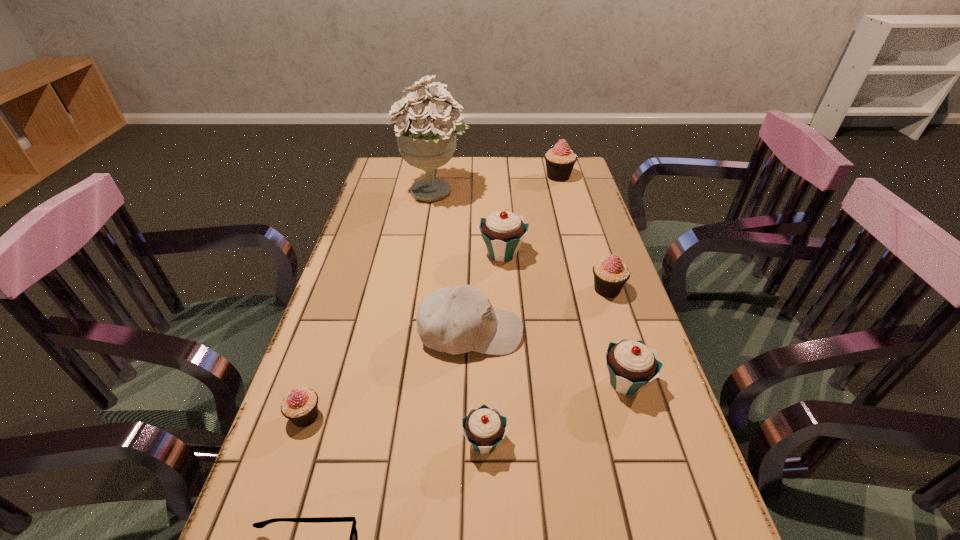
Where is `free space located on the front of the second nearest teal cupcake`? The image size is (960, 540). free space located on the front of the second nearest teal cupcake is located at coordinates (659, 495).

Where is `free spot located on the right of the leftmost pink cupcake`? free spot located on the right of the leftmost pink cupcake is located at coordinates (348, 416).

Where is `free space located on the front of the nearest teal cupcake`? This screenshot has width=960, height=540. free space located on the front of the nearest teal cupcake is located at coordinates (485, 503).

What are the coordinates of `bouquet that is at the far edge` in the screenshot? It's located at (426, 139).

At what (x,y) coordinates should I click in order to perform the action: click on cupcake located at the far edge. Please return your answer as a coordinate pair (x, y). Looking at the image, I should click on pyautogui.click(x=560, y=160).

Identify the location of bouquet that is at the left edge. This screenshot has width=960, height=540. (426, 139).

Where is `cupcake that is at the left edge`? The image size is (960, 540). cupcake that is at the left edge is located at coordinates (300, 406).

Identify the location of object at the far left corner. (426, 139).

Find the location of a particular element. This screenshot has height=540, width=960. object positioned at the far right corner is located at coordinates (560, 160).

Where is `vacant point at the far edge`? The width and height of the screenshot is (960, 540). vacant point at the far edge is located at coordinates (494, 157).